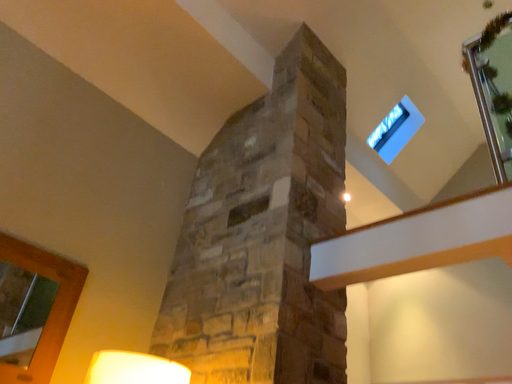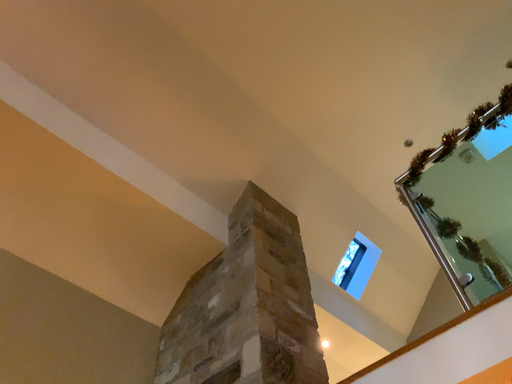
Question: Which way did the camera rotate in the video?

Choices:
 (A) rotated upward
 (B) rotated downward

Answer: (A)